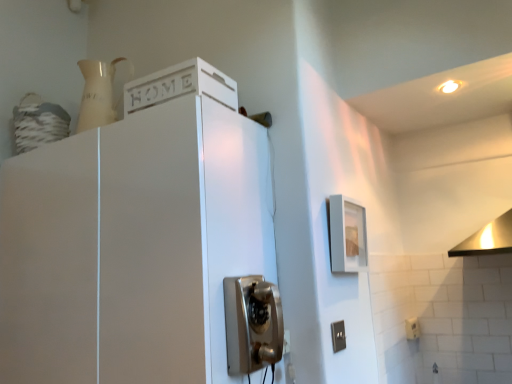
Question: Should I look upward or downward to see metallic vintage phone at center?

Choices:
 (A) down
 (B) up

Answer: (A)

Question: Can you confirm if white plastic electric outlet at lower right, which ranks as the first electric outlet in back-to-front order, is smaller than gray plastic electrical outlet at lower right, positioned as the second electric outlet in right-to-left order?

Choices:
 (A) no
 (B) yes

Answer: (A)

Question: Is white plastic electric outlet at lower right, marked as the 1th electric outlet in a right-to-left arrangement, wider than gray plastic electrical outlet at lower right, the 2th electric outlet positioned from the back?

Choices:
 (A) no
 (B) yes

Answer: (B)

Question: Is gray plastic electrical outlet at lower right, which is the 2th electric outlet from bottom to top, located within white plastic electric outlet at lower right, which ranks as the first electric outlet in back-to-front order?

Choices:
 (A) yes
 (B) no

Answer: (B)

Question: Can you see white plastic electric outlet at lower right, which is counted as the 2th electric outlet, starting from the front, touching gray plastic electrical outlet at lower right, which is the 2th electric outlet from bottom to top?

Choices:
 (A) no
 (B) yes

Answer: (A)

Question: From a real-world perspective, is white plastic electric outlet at lower right, which is counted as the 2th electric outlet, starting from the front, positioned over gray plastic electrical outlet at lower right, which ranks as the first electric outlet in left-to-right order, based on gravity?

Choices:
 (A) yes
 (B) no

Answer: (B)

Question: Considering the relative sizes of white plastic electric outlet at lower right, which is counted as the 2th electric outlet, starting from the front, and gray plastic electrical outlet at lower right, which ranks as the first electric outlet in left-to-right order, in the image provided, is white plastic electric outlet at lower right, which is counted as the 2th electric outlet, starting from the front, shorter than gray plastic electrical outlet at lower right, which ranks as the first electric outlet in left-to-right order,?

Choices:
 (A) yes
 (B) no

Answer: (A)

Question: Does white matte cabinet at upper left lie behind metallic vintage phone at center?

Choices:
 (A) yes
 (B) no

Answer: (B)

Question: Is white matte cabinet at upper left taller than metallic vintage phone at center?

Choices:
 (A) no
 (B) yes

Answer: (B)

Question: Considering the relative sizes of white matte cabinet at upper left and metallic vintage phone at center in the image provided, is white matte cabinet at upper left shorter than metallic vintage phone at center?

Choices:
 (A) no
 (B) yes

Answer: (A)

Question: From the image's perspective, does white matte cabinet at upper left appear lower than metallic vintage phone at center?

Choices:
 (A) no
 (B) yes

Answer: (A)

Question: From the image's perspective, is white matte cabinet at upper left over metallic vintage phone at center?

Choices:
 (A) no
 (B) yes

Answer: (B)

Question: Is white matte cabinet at upper left far away from metallic vintage phone at center?

Choices:
 (A) no
 (B) yes

Answer: (A)

Question: Is gray plastic electrical outlet at lower right, which ranks as the first electric outlet in left-to-right order, thinner than white matte cabinet at upper left?

Choices:
 (A) yes
 (B) no

Answer: (A)